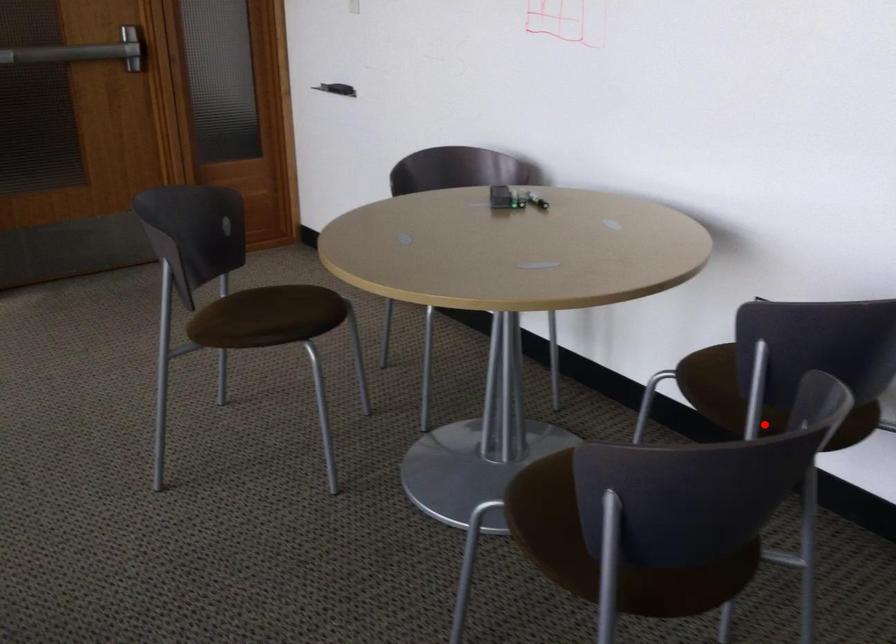
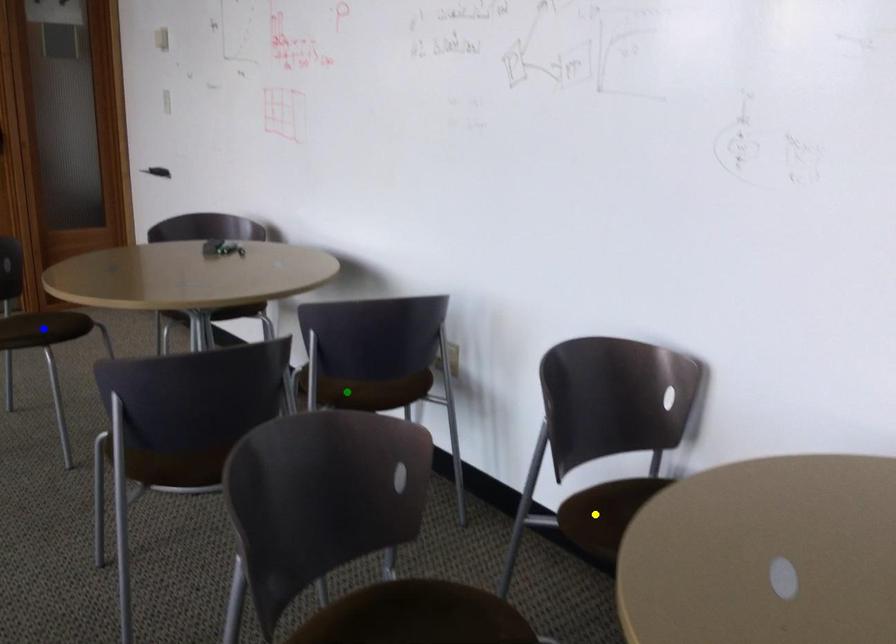
Question: I am providing you with two images of the same scene from different viewpoints. A red point is marked on the first image. You are given multiple points on the second image. Can you choose the point in image 2 that corresponds to the point in image 1?

Choices:
 (A) blue point
 (B) yellow point
 (C) green point

Answer: (C)